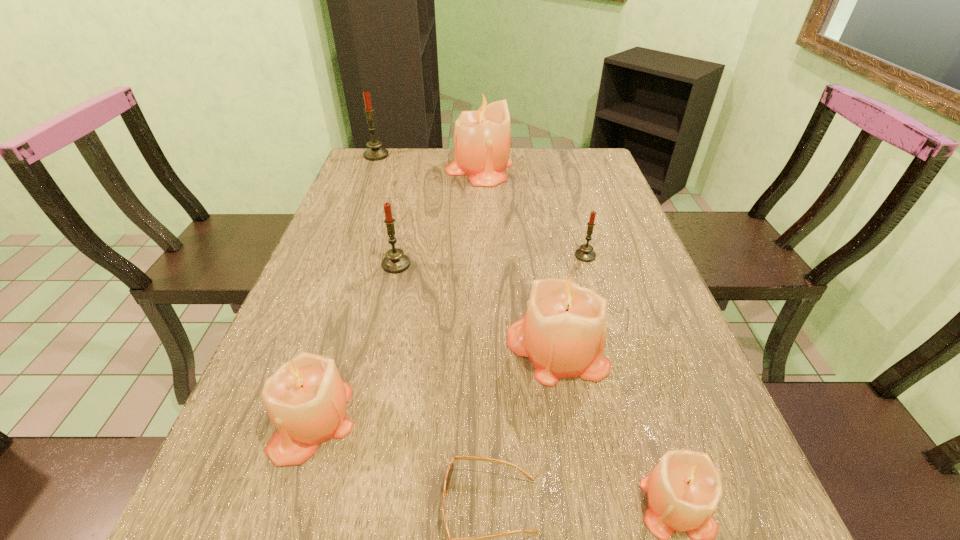
The width and height of the screenshot is (960, 540). Identify the location of the biggest beige candle. (482, 147).

Locate an element on the screen. This screenshot has width=960, height=540. the farthest red candle is located at coordinates (375, 152).

Identify the location of the leftmost red candle. (375, 152).

Image resolution: width=960 pixels, height=540 pixels. I want to click on the third smallest beige candle, so click(563, 333).

Locate an element on the screen. The image size is (960, 540). the second biggest red candle is located at coordinates (395, 261).

I want to click on the third biggest beige candle, so click(x=306, y=398).

You are a GUI agent. You are given a task and a screenshot of the screen. Output one action in this format:
    pyautogui.click(x=<x>, y=<y>)
    Task: Click on the rightmost red candle
    The image size is (960, 540).
    Given the screenshot: What is the action you would take?
    pyautogui.click(x=585, y=253)

Locate an element on the screen. free spot located on the front of the biggest beige candle is located at coordinates (479, 240).

The width and height of the screenshot is (960, 540). I want to click on vacant space located 0.180m on the front of the leftmost red candle, so click(364, 187).

Identify the location of vacant space located 0.220m on the left of the second biggest beige candle. (399, 349).